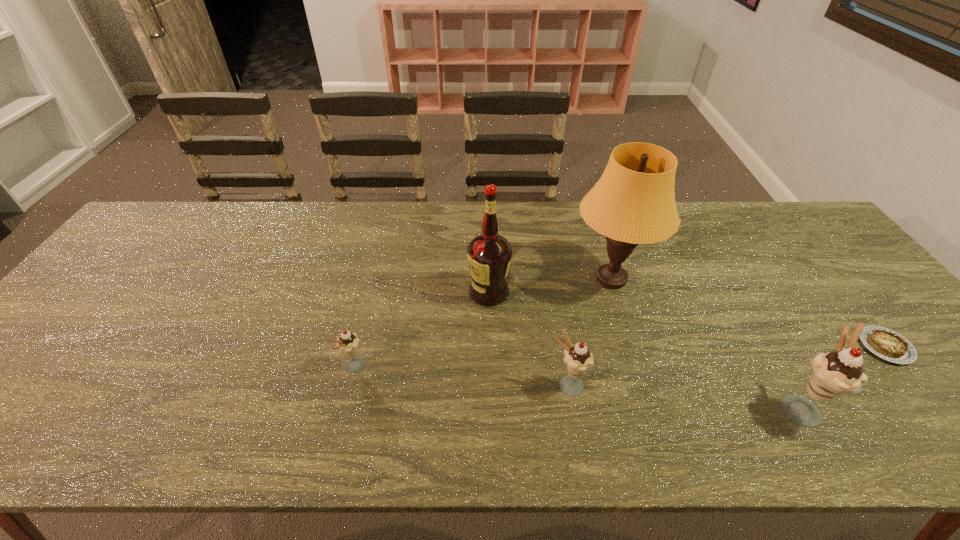
The height and width of the screenshot is (540, 960). Find the location of `vacant space at the near edge of the desktop`. vacant space at the near edge of the desktop is located at coordinates (124, 395).

Locate an element on the screen. free space at the left edge is located at coordinates [x=132, y=278].

The image size is (960, 540). I want to click on vacant region at the right edge of the desktop, so click(879, 315).

The height and width of the screenshot is (540, 960). Identify the location of vacant space at the near left corner. (42, 391).

Locate an element on the screen. free location at the far right corner of the desktop is located at coordinates [780, 245].

This screenshot has height=540, width=960. In order to click on unoccupied position between the shortest object and the fifth object from right to left in this screenshot , I will do `click(687, 319)`.

Image resolution: width=960 pixels, height=540 pixels. I want to click on free spot between the shortest object and the leftmost icecream, so click(x=620, y=357).

Image resolution: width=960 pixels, height=540 pixels. Find the location of `empty space between the fourth shortest object and the alcohol`. empty space between the fourth shortest object and the alcohol is located at coordinates (643, 349).

I want to click on free space between the rightmost icecream and the alcohol, so coord(643,349).

The image size is (960, 540). Find the location of `blank region between the quiche and the fifth object from right to left`. blank region between the quiche and the fifth object from right to left is located at coordinates (687, 319).